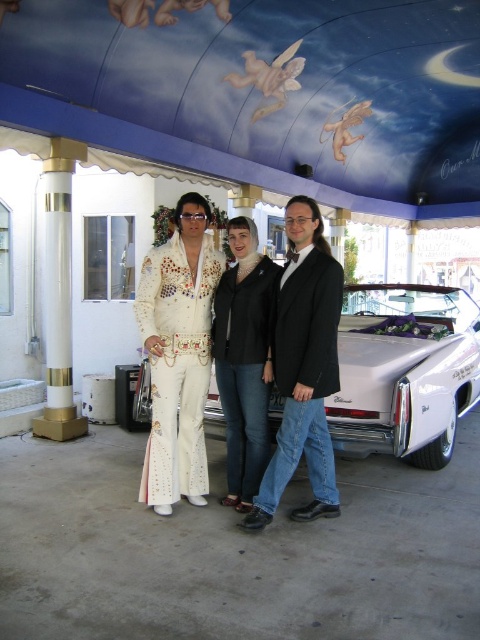
Which is behind, point (216, 353) or point (217, 310)?

The point (217, 310) is more distant.

Can you confirm if white sequined suit at center is positioned below black matte jacket at center?

No, white sequined suit at center is not below black matte jacket at center.

Where is `white sequined suit at center`? This screenshot has width=480, height=640. white sequined suit at center is located at coordinates (277, 362).

Does white satin dress at center have a lesser height compared to shiny black suit at center?

No.

Who is more distant from viewer, (x=195, y=333) or (x=324, y=260)?

The point (x=195, y=333) is more distant.

Is point (163, 266) positioned after point (340, 268)?

Yes, it is behind point (340, 268).

You are a GUI agent. You are given a task and a screenshot of the screen. Output one action in this format:
    pyautogui.click(x=<x>, y=<y>)
    Task: Click on the white satin dress at center
    The width and height of the screenshot is (480, 640).
    Given the screenshot: What is the action you would take?
    pyautogui.click(x=178, y=355)

Does point (191, 227) lie behind point (51, 388)?

No, (191, 227) is in front of (51, 388).

In the scene shown: Which of these two, white satin dress at center or white glossy column at left, stands taller?

white glossy column at left

Describe the element at coordinates (178, 355) in the screenshot. The height and width of the screenshot is (640, 480). I see `white satin dress at center` at that location.

At what (x,y) coordinates should I click in order to perform the action: click on white satin dress at center. Please return your answer as a coordinate pair (x, y). Looking at the image, I should click on (178, 355).